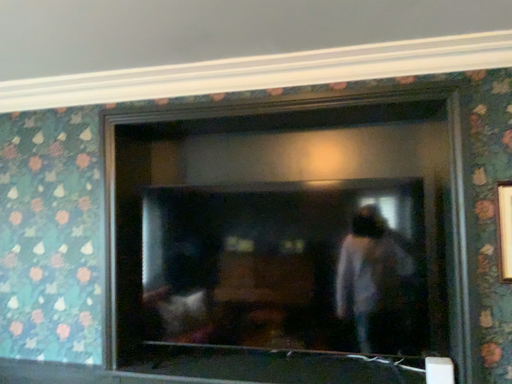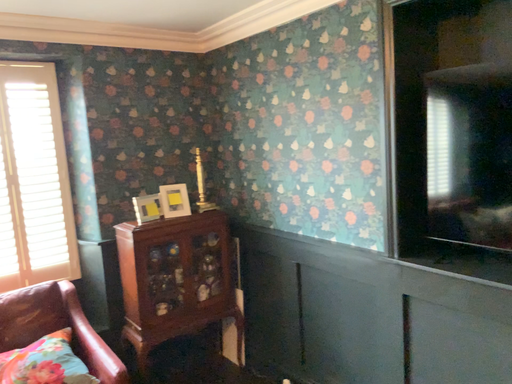
Question: Which way did the camera rotate in the video?

Choices:
 (A) rotated downward
 (B) rotated upward

Answer: (A)